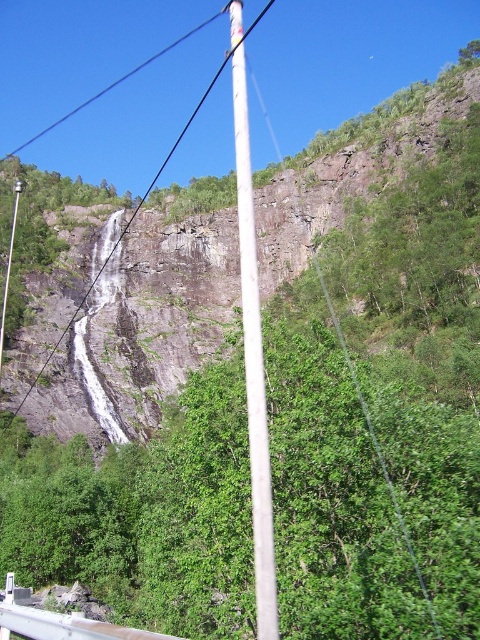
Who is shorter, white smooth pole at center or white plastic pole at center?

With less height is white smooth pole at center.

Can you confirm if white smooth pole at center is positioned below white plastic pole at center?

Actually, white smooth pole at center is above white plastic pole at center.

Between point (262, 512) and point (22, 406), which one is positioned in front?

Positioned in front is point (262, 512).

Identify the location of white smooth pole at center. [x=252, y=346].